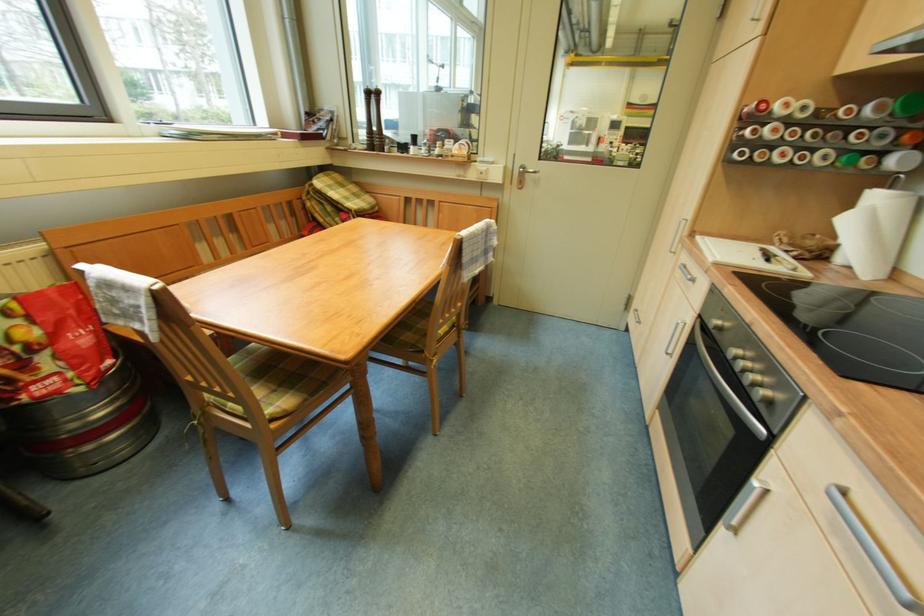
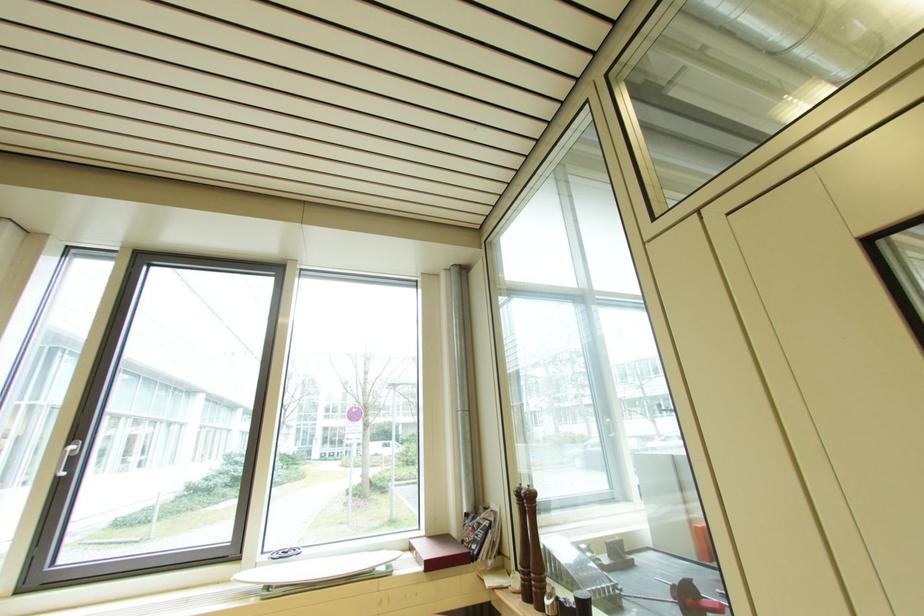
In the second image, find the point that corresponds to [394,150] in the first image.

(554, 605)